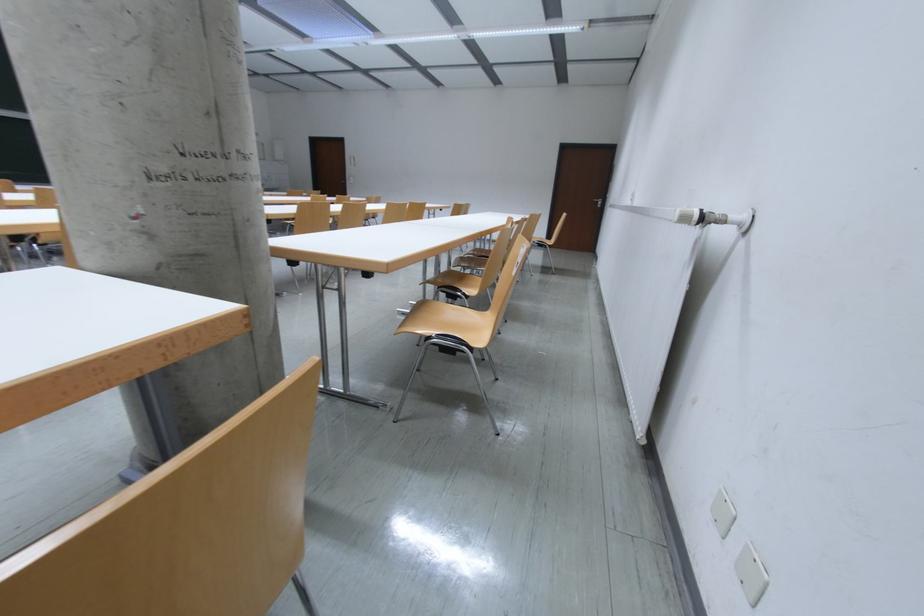
The width and height of the screenshot is (924, 616). Describe the element at coordinates (690, 217) in the screenshot. I see `the white radiator knob` at that location.